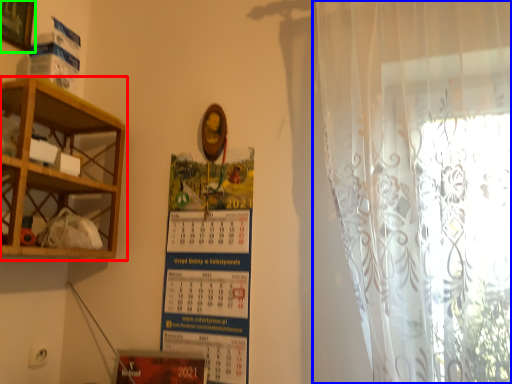
Question: Which is farther away from shelf (highlighted by a red box)? curtain (highlighted by a blue box) or picture frame (highlighted by a green box)?

Choices:
 (A) curtain
 (B) picture frame

Answer: (A)